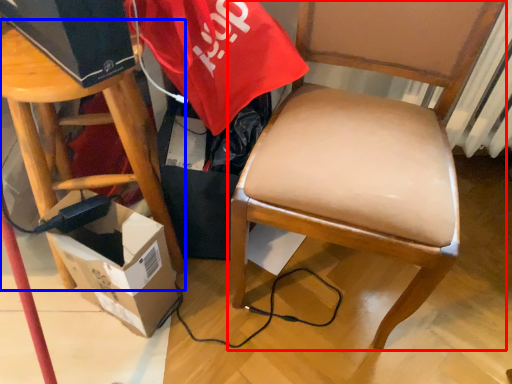
Question: Among these objects, which one is farthest to the camera, chair (highlighted by a red box) or stool (highlighted by a blue box)?

Choices:
 (A) chair
 (B) stool

Answer: (B)